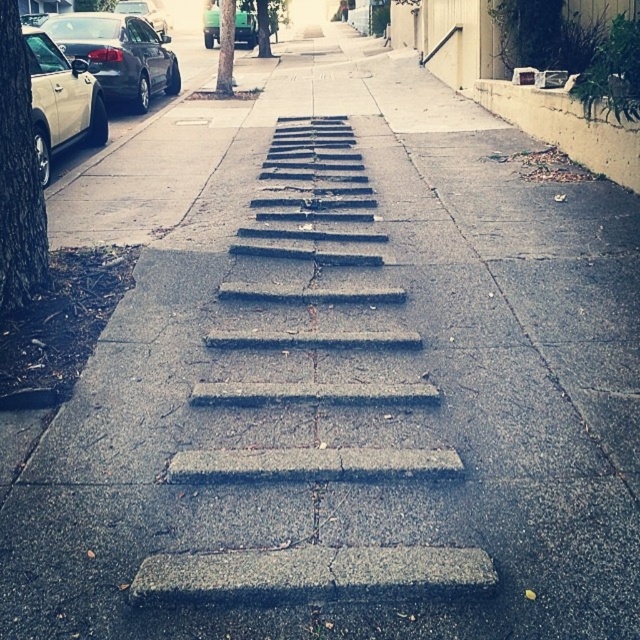
You are a delivery person trying to park your bike between the gray concrete steps at center and the shiny black sedan at left. Is there enough space for your bike?

The gray concrete steps at center is positioned under the shiny black sedan at left, meaning there isn not enough space between them to park a bike.

You are standing on the sidewalk looking at the scene. There are two points marked in the image, point 1 at coordinates point (76, 80) and point 2 at coordinates point (243, 29). Which point is closer to your current position?

Point (76, 80) is closer to the camera than point (243, 29), so it is closer to your current position.

You are standing on the sidewalk and see the matte silver car at left and the green matte truck at upper center. Which vehicle is positioned more to the left?

The green matte truck at upper center is positioned more to the left because the matte silver car at left is to the right of it.